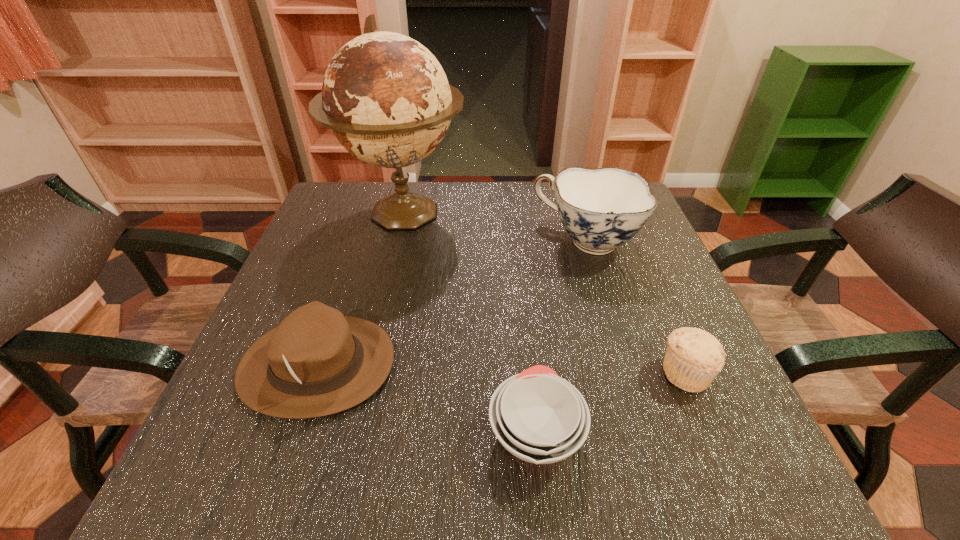
The image size is (960, 540). Find the location of `blank space that satisfies the following two spatial constraints: 1. on the feather side of the second shortest object; 2. on the right side of the third shortest object`. blank space that satisfies the following two spatial constraints: 1. on the feather side of the second shortest object; 2. on the right side of the third shortest object is located at coordinates (315, 373).

Where is `vacant space that satisfies the following two spatial constraints: 1. on the front of the soup bowl showing Asia; 2. on the left side of the globe`? The image size is (960, 540). vacant space that satisfies the following two spatial constraints: 1. on the front of the soup bowl showing Asia; 2. on the left side of the globe is located at coordinates (349, 433).

Identify the location of vacant position in the image that satisfies the following two spatial constraints: 1. on the front of the tallest object showing Asia; 2. on the left side of the muffin. (364, 373).

Where is `vacant point that satisfies the following two spatial constraints: 1. on the front of the soup bowl showing Asia; 2. on the left side of the tallest object`? vacant point that satisfies the following two spatial constraints: 1. on the front of the soup bowl showing Asia; 2. on the left side of the tallest object is located at coordinates (349, 433).

Locate an element on the screen. Image resolution: width=960 pixels, height=540 pixels. vacant space that satisfies the following two spatial constraints: 1. on the front of the shortest object showing Asia; 2. on the right side of the globe is located at coordinates (349, 433).

You are a GUI agent. You are given a task and a screenshot of the screen. Output one action in this format:
    pyautogui.click(x=<x>, y=<y>)
    Task: Click on the vacant space that satisfies the following two spatial constraints: 1. on the back side of the soup bowl; 2. on the feather side of the fedora
    
    Given the screenshot: What is the action you would take?
    pyautogui.click(x=529, y=364)

Image resolution: width=960 pixels, height=540 pixels. Find the location of `free space that satisfies the following two spatial constraints: 1. on the front of the globe showing Asia; 2. on the left side of the soup bowl`. free space that satisfies the following two spatial constraints: 1. on the front of the globe showing Asia; 2. on the left side of the soup bowl is located at coordinates (349, 433).

You are a GUI agent. You are given a task and a screenshot of the screen. Output one action in this format:
    pyautogui.click(x=<x>, y=<y>)
    Task: Click on the vacant position in the image that satisfies the following two spatial constraints: 1. on the back side of the fourth tallest object; 2. on the feather side of the third shortest object
    This screenshot has height=540, width=960.
    Given the screenshot: What is the action you would take?
    pyautogui.click(x=682, y=364)